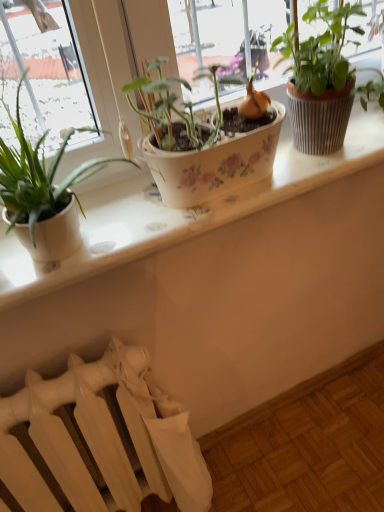
Question: Considering the positions of white ceramic window sill at center and textured brown pot at upper right, the 1th houseplant viewed from the right, in the image, is white ceramic window sill at center bigger or smaller than textured brown pot at upper right, the 1th houseplant viewed from the right,?

Choices:
 (A) big
 (B) small

Answer: (B)

Question: In terms of width, does white ceramic window sill at center look wider or thinner when compared to textured brown pot at upper right, the 1th houseplant viewed from the right?

Choices:
 (A) wide
 (B) thin

Answer: (A)

Question: Considering the real-world distances, which object is closest to the white ceramic window sill at center?

Choices:
 (A) matte white pot at left, which ranks as the 1th houseplant in left-to-right order
 (B) white matte radiator at lower left
 (C) textured brown pot at upper right, acting as the 2th houseplant starting from the left

Answer: (A)

Question: Based on their relative distances, which object is nearer to the white ceramic window sill at center?

Choices:
 (A) textured brown pot at upper right, the 1th houseplant viewed from the right
 (B) matte white pot at left, which ranks as the 1th houseplant in left-to-right order
 (C) white matte radiator at lower left

Answer: (B)